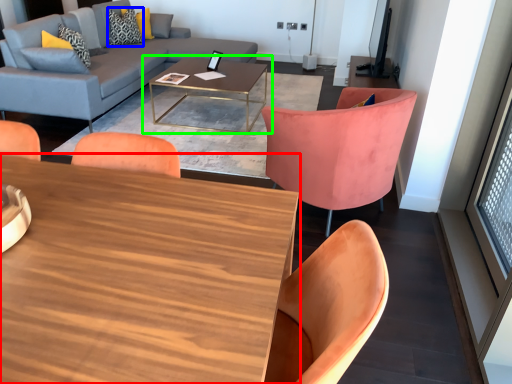
Question: Which is nearer to the coffee table (highlighted by a red box)? pillow (highlighted by a blue box) or coffee table (highlighted by a green box).

Choices:
 (A) pillow
 (B) coffee table

Answer: (B)